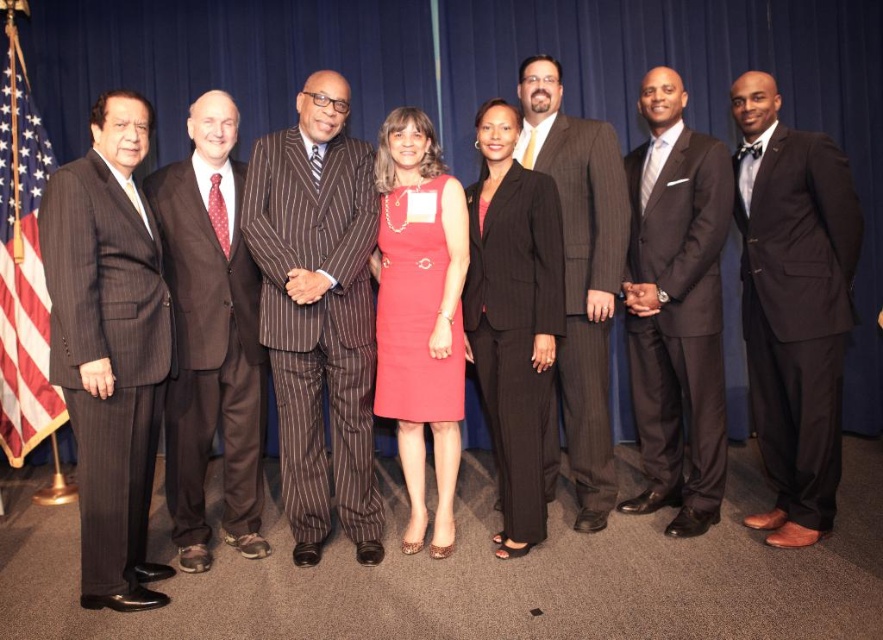
Is matte black suit at center behind matte red dress at center?

Yes, matte black suit at center is further from the viewer.

Who is taller, matte black suit at center or matte red dress at center?

matte black suit at center is taller.

Who is more forward, (702, 369) or (435, 172)?

Point (702, 369) is in front.

At what (x,y) coordinates should I click in order to perform the action: click on matte black suit at center. Please return your answer as a coordinate pair (x, y). The image size is (883, 640). Looking at the image, I should click on click(x=676, y=307).

Does matte black suit at center have a lesser height compared to matte pinstripe suit at center?

Correct, matte black suit at center is not as tall as matte pinstripe suit at center.

Is matte black suit at center to the left of matte pinstripe suit at center from the viewer's perspective?

Incorrect, matte black suit at center is not on the left side of matte pinstripe suit at center.

This screenshot has width=883, height=640. Identify the location of matte black suit at center. (676, 307).

Can you confirm if brown pinstripe suit at center is smaller than matte black suit at center?

No, brown pinstripe suit at center is not smaller than matte black suit at center.

Is brown pinstripe suit at center above matte black suit at center?

Actually, brown pinstripe suit at center is below matte black suit at center.

Does point (315, 557) come farther from viewer compared to point (685, 100)?

No, (315, 557) is in front of (685, 100).

Locate an element on the screen. The image size is (883, 640). brown pinstripe suit at center is located at coordinates (318, 312).